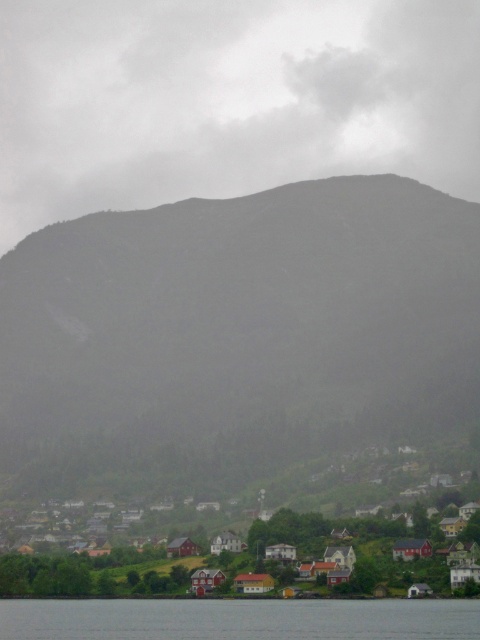
You are a hiker standing on the lakeshore and want to estimate the elevation difference between the green textured mountain at center and the red wooden houses at lower center. Which one is taller?

The green textured mountain at center is taller than the red wooden houses at lower center according to the description.

Based on the scene description, where is the green textured mountain at center located in terms of its 2D coordinates?

The green textured mountain at center is located at the 2D coordinates of point (240, 328).

You are standing at the edge of the transparent water at lower center and looking towards the green textured mountain at center. Which direction should you face to have the mountain in front of you?

You should face upwards because the green textured mountain at center is above the transparent water at lower center, so facing upwards will place the mountain directly in front of you.